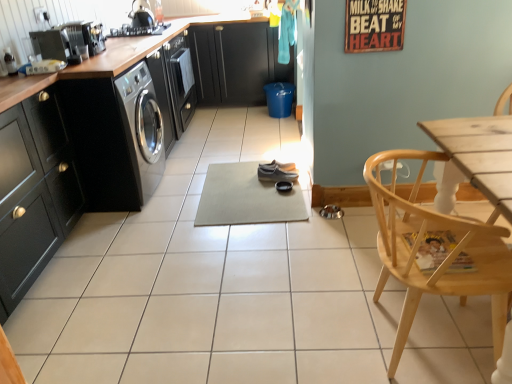
The width and height of the screenshot is (512, 384). In order to click on free location above beige rubber yoga mat at center (from a real-world perspective) in this screenshot , I will do `click(261, 172)`.